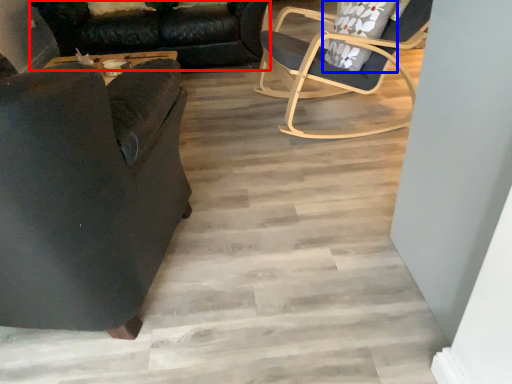
Question: Which object is closer to the camera taking this photo, studio couch (highlighted by a red box) or pillow (highlighted by a blue box)?

Choices:
 (A) studio couch
 (B) pillow

Answer: (B)